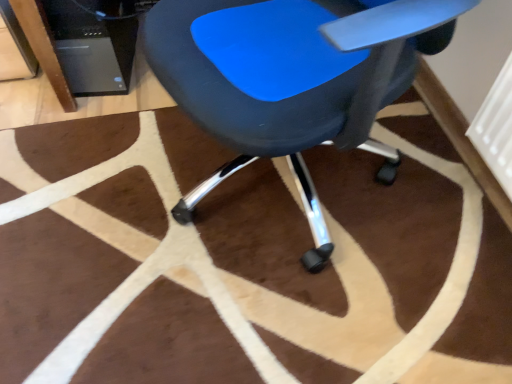
Question: Does blue plastic chair at center touch brown fuzzy rug at center?

Choices:
 (A) no
 (B) yes

Answer: (A)

Question: Is blue plastic chair at center outside of brown fuzzy rug at center?

Choices:
 (A) no
 (B) yes

Answer: (B)

Question: Considering the relative positions of blue plastic chair at center and brown fuzzy rug at center in the image provided, is blue plastic chair at center to the right of brown fuzzy rug at center from the viewer's perspective?

Choices:
 (A) no
 (B) yes

Answer: (B)

Question: Is there a large distance between blue plastic chair at center and brown fuzzy rug at center?

Choices:
 (A) yes
 (B) no

Answer: (B)

Question: Is brown fuzzy rug at center a part of blue plastic chair at center?

Choices:
 (A) no
 (B) yes

Answer: (A)

Question: Considering the relative sizes of blue plastic chair at center and brown fuzzy rug at center in the image provided, is blue plastic chair at center taller than brown fuzzy rug at center?

Choices:
 (A) no
 (B) yes

Answer: (B)

Question: Is there a large distance between brown fuzzy rug at center and black plastic computer tower at upper left?

Choices:
 (A) no
 (B) yes

Answer: (A)

Question: Is brown fuzzy rug at center beside black plastic computer tower at upper left?

Choices:
 (A) no
 (B) yes

Answer: (A)

Question: From the image's perspective, is brown fuzzy rug at center on top of black plastic computer tower at upper left?

Choices:
 (A) no
 (B) yes

Answer: (A)

Question: Is brown fuzzy rug at center surrounding black plastic computer tower at upper left?

Choices:
 (A) yes
 (B) no

Answer: (B)

Question: Is black plastic computer tower at upper left at the back of brown fuzzy rug at center?

Choices:
 (A) yes
 (B) no

Answer: (B)

Question: Does brown fuzzy rug at center have a larger size compared to black plastic computer tower at upper left?

Choices:
 (A) yes
 (B) no

Answer: (A)

Question: Considering the relative positions of blue plastic chair at center and black plastic computer tower at upper left in the image provided, is blue plastic chair at center to the right of black plastic computer tower at upper left from the viewer's perspective?

Choices:
 (A) no
 (B) yes

Answer: (B)